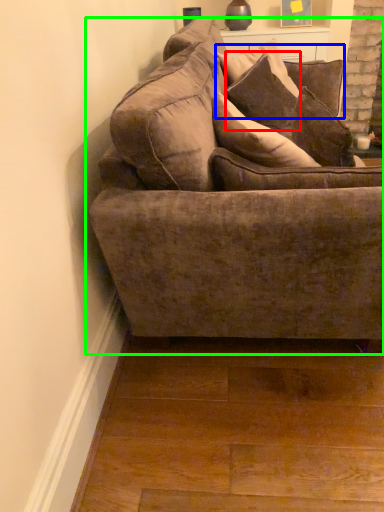
Question: Based on their relative distances, which object is nearer to pillow (highlighted by a red box)? Choose from pillow (highlighted by a blue box) and studio couch (highlighted by a green box).

Choices:
 (A) pillow
 (B) studio couch

Answer: (A)